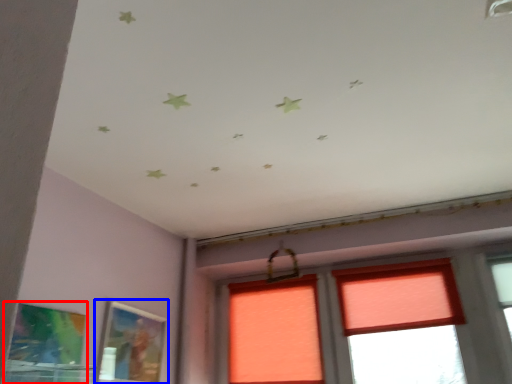
Question: Which point is closer to the camera, picture frame (highlighted by a red box) or picture frame (highlighted by a blue box)?

Choices:
 (A) picture frame
 (B) picture frame

Answer: (A)